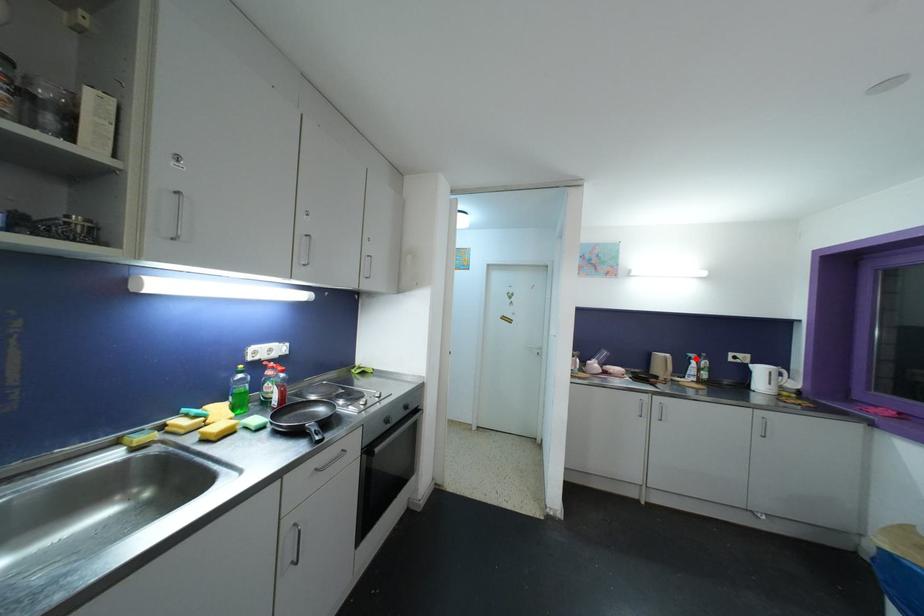
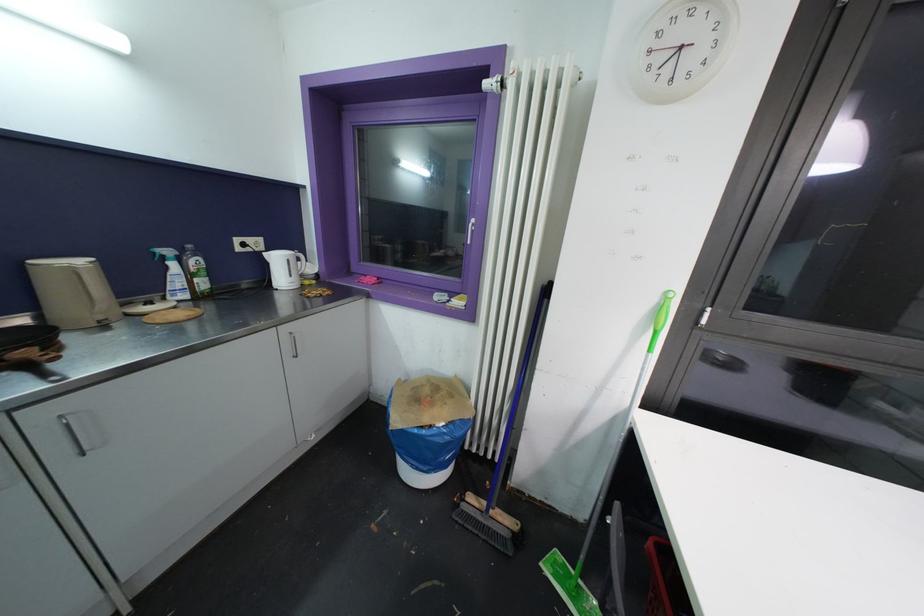
Where in the second image is the point corresponding to the highlighted location from the first image?

(171, 254)